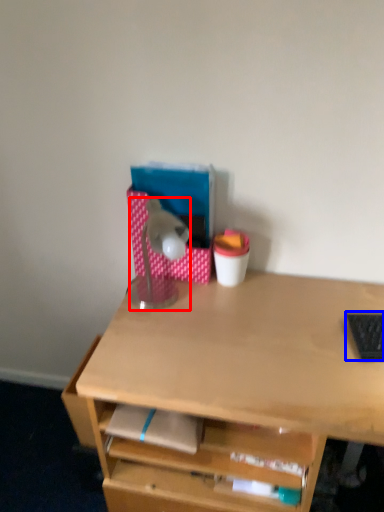
Question: Which point is closer to the camera, lamp (highlighted by a red box) or laptop keyboard (highlighted by a blue box)?

Choices:
 (A) lamp
 (B) laptop keyboard

Answer: (B)